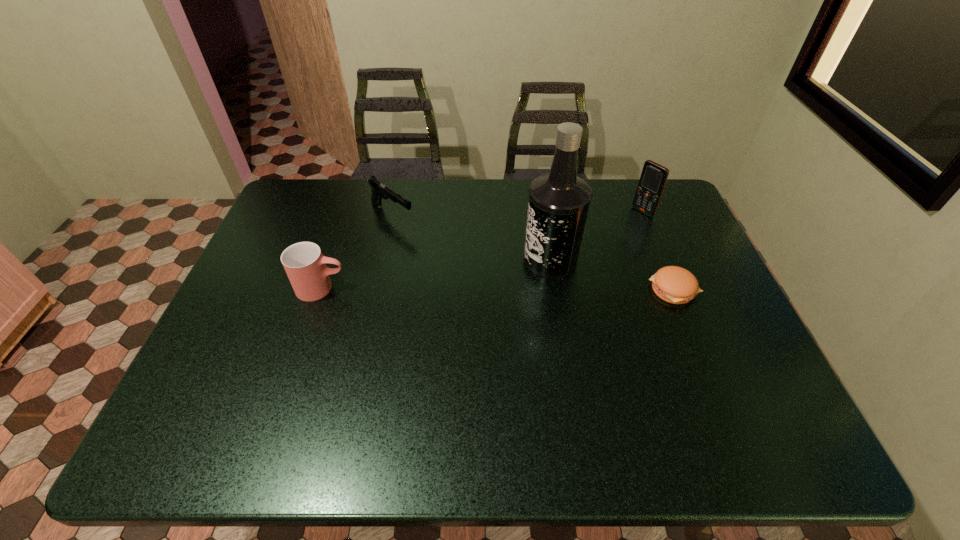
Identify the location of vacant space that is in between the fourth shortest object and the patty. Image resolution: width=960 pixels, height=540 pixels. (659, 251).

Find the location of `free space between the cup and the shortest object`. free space between the cup and the shortest object is located at coordinates (498, 289).

Find the location of a particular element. The image size is (960, 540). free space that is in between the patty and the tallest object is located at coordinates (612, 275).

Image resolution: width=960 pixels, height=540 pixels. I want to click on vacant space that is in between the cup and the shortest object, so click(498, 289).

Identify the location of empty space that is in between the gun and the fourth shortest object. The width and height of the screenshot is (960, 540). (517, 213).

Where is `vacant space in between the tallest object and the shortest object`? vacant space in between the tallest object and the shortest object is located at coordinates (612, 275).

Locate which object ranks second in proximity to the patty. Please provide its 2D coordinates. Your answer should be formatted as a tuple, i.e. [(x, y)], where the tuple contains the x and y coordinates of a point satisfying the conditions above.

[(653, 178)]

Image resolution: width=960 pixels, height=540 pixels. In order to click on the second closest object to the cup in this screenshot , I will do `click(559, 201)`.